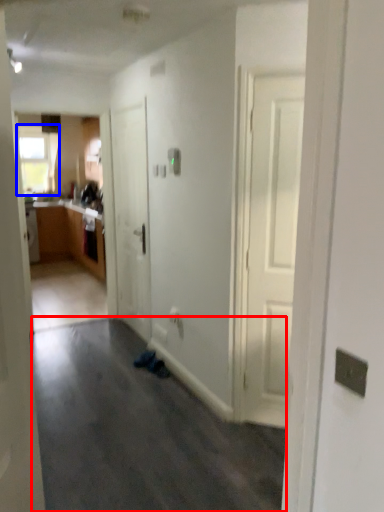
Question: Which object appears closest to the camera in this image, plain (highlighted by a red box) or window (highlighted by a blue box)?

Choices:
 (A) plain
 (B) window

Answer: (A)